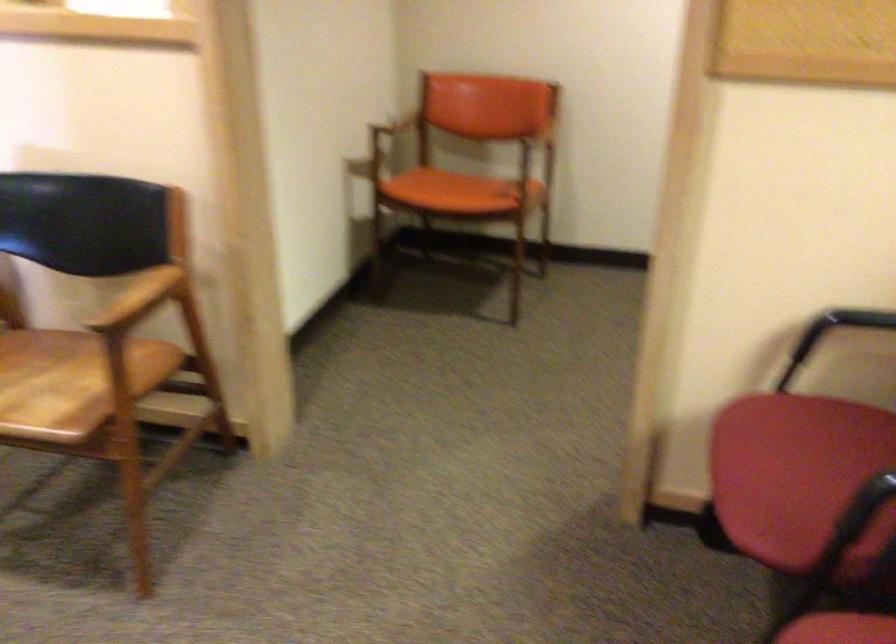
What do you see at coordinates (455, 192) in the screenshot?
I see `the orange chair sitting surface` at bounding box center [455, 192].